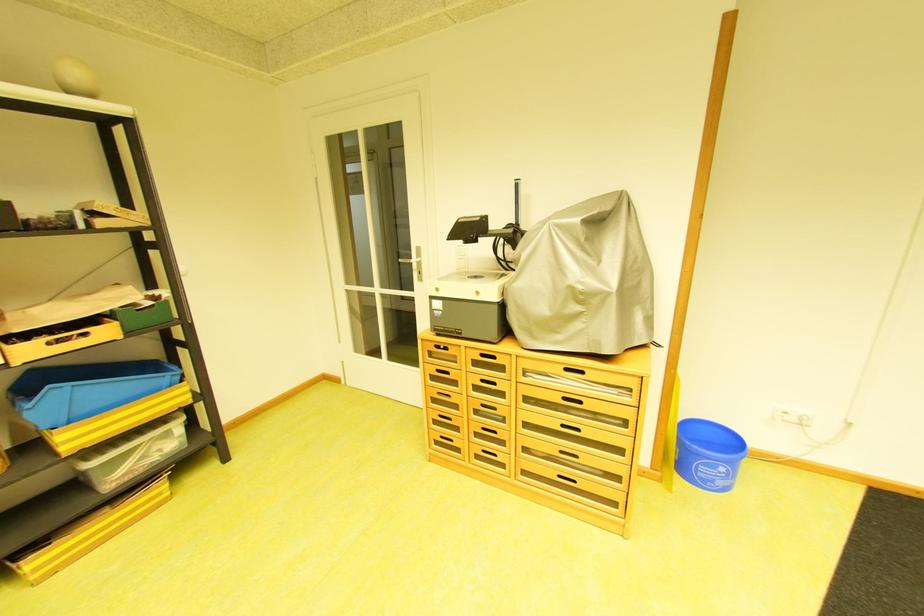
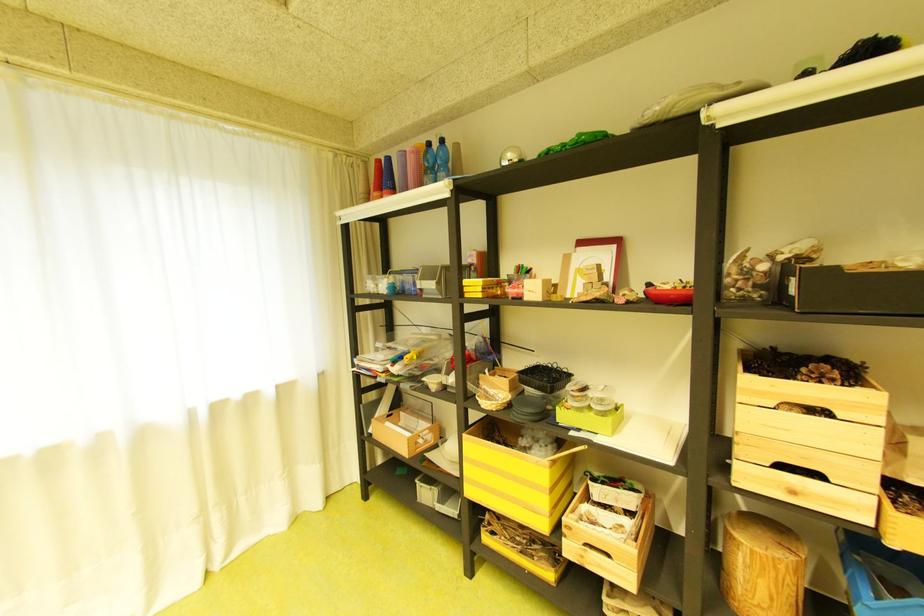
Question: Based on the continuous images, in which direction is the camera rotating? Reply with the corresponding letter.

Choices:
 (A) Left
 (B) Right
 (C) Up
 (D) Down

Answer: (A)